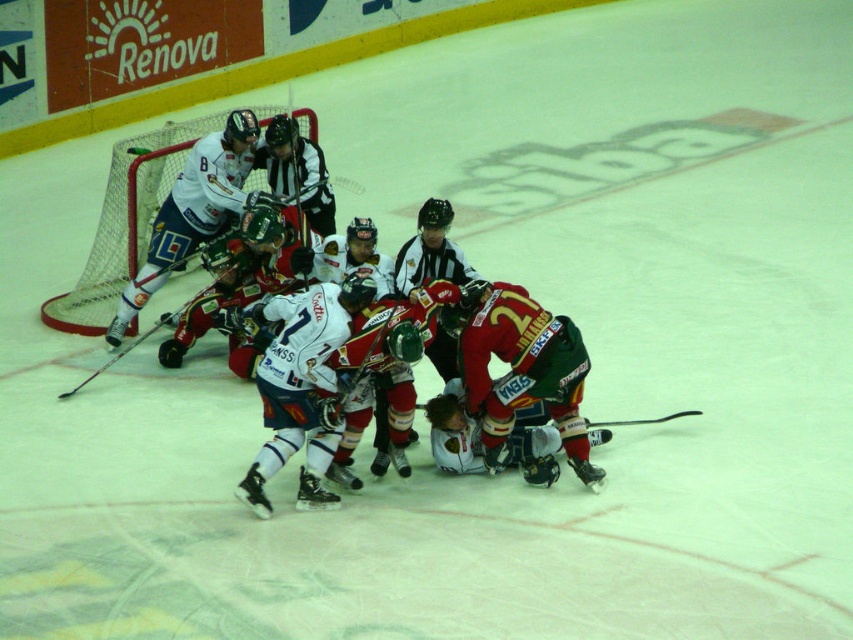
Between red jersey at center and white matte jersey at left, which one has more height?

Standing taller between the two is white matte jersey at left.

Between point (518, 365) and point (227, 221), which one is positioned behind?

The point (227, 221) is more distant.

Describe the element at coordinates (521, 371) in the screenshot. This screenshot has width=853, height=640. I see `red jersey at center` at that location.

The width and height of the screenshot is (853, 640). I want to click on red jersey at center, so click(521, 371).

Which of these two, red jersey hockey players at center or white matte jersey at left, stands shorter?

red jersey hockey players at center

Which is more to the left, red jersey hockey players at center or white matte jersey at left?

white matte jersey at left

What do you see at coordinates (511, 340) in the screenshot?
I see `red jersey hockey players at center` at bounding box center [511, 340].

Where is `red jersey hockey players at center`? This screenshot has width=853, height=640. red jersey hockey players at center is located at coordinates (511, 340).

Does red jersey at center have a lesser width compared to black matte hockey stick at left?

Yes.

Is red jersey at center to the right of black matte hockey stick at left from the viewer's perspective?

Indeed, red jersey at center is positioned on the right side of black matte hockey stick at left.

Between point (581, 442) and point (131, 346), which one is positioned behind?

Point (131, 346)

The width and height of the screenshot is (853, 640). In order to click on red jersey at center in this screenshot , I will do `click(521, 371)`.